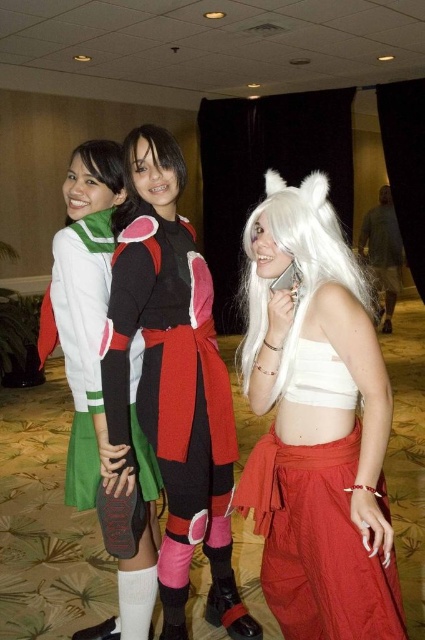
Between matte black and red costume at center and matte black wig at center, which one appears on the right side from the viewer's perspective?

matte black and red costume at center

Between matte black and red costume at center and matte black wig at center, which one has more height?

matte black and red costume at center is taller.

This screenshot has width=425, height=640. What do you see at coordinates (173, 380) in the screenshot?
I see `matte black and red costume at center` at bounding box center [173, 380].

Locate an element on the screen. matte black and red costume at center is located at coordinates (173, 380).

Is matte black and red costume at center bigger than white silky wig at center?

Yes.

Is matte black and red costume at center smaller than white silky wig at center?

Incorrect, matte black and red costume at center is not smaller in size than white silky wig at center.

Which is behind, point (115, 410) or point (252, 253)?

Positioned behind is point (115, 410).

Locate an element on the screen. This screenshot has width=425, height=640. matte black and red costume at center is located at coordinates (173, 380).

Measure the distance between white fabric skirt at center and camera.

white fabric skirt at center is 1.24 meters from camera.

In the scene shown: Who is positioned more to the left, white fabric skirt at center or green fabric skirt at center?

green fabric skirt at center is more to the left.

Describe the element at coordinates (317, 426) in the screenshot. I see `white fabric skirt at center` at that location.

In order to click on white fabric skirt at center in this screenshot , I will do `click(317, 426)`.